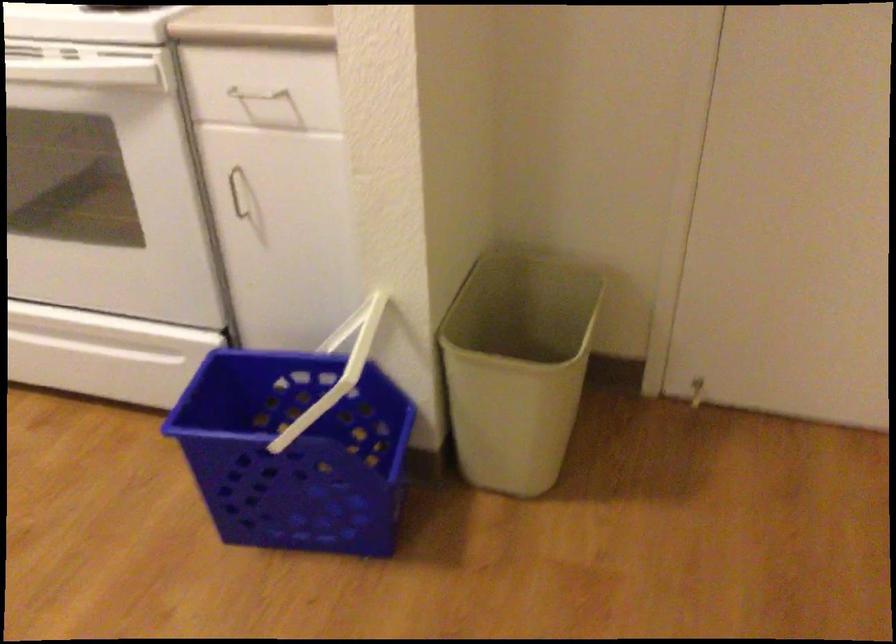
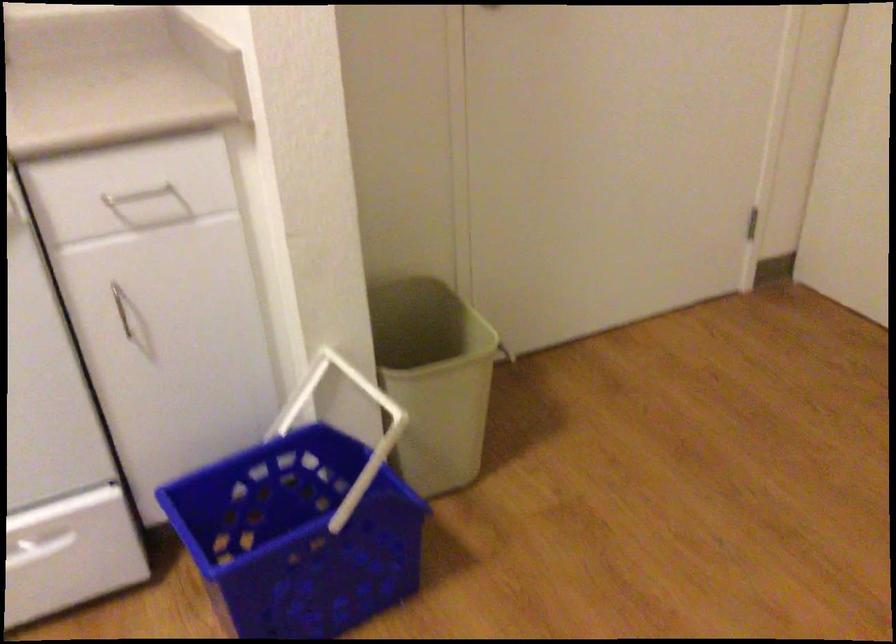
Locate, in the second image, the point that corresponds to (x=260, y=98) in the first image.

(138, 194)